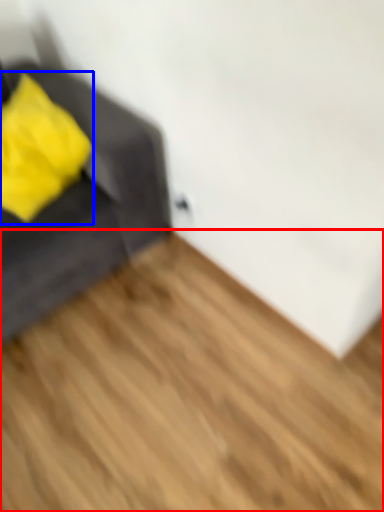
Question: Which object appears farthest to the camera in this image, hardwood (highlighted by a red box) or throw pillow (highlighted by a blue box)?

Choices:
 (A) hardwood
 (B) throw pillow

Answer: (B)